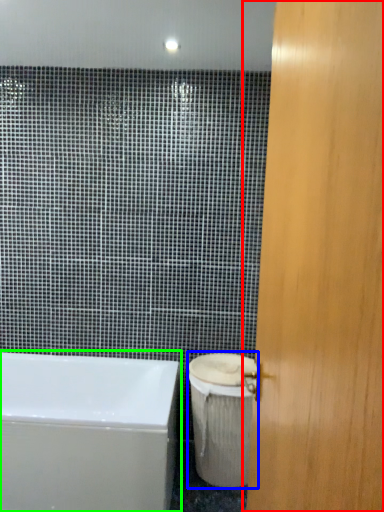
Question: Considering the real-world distances, which object is closest to door (highlighted by a red box)? toilet bowl (highlighted by a blue box) or bathtub (highlighted by a green box).

Choices:
 (A) toilet bowl
 (B) bathtub

Answer: (A)